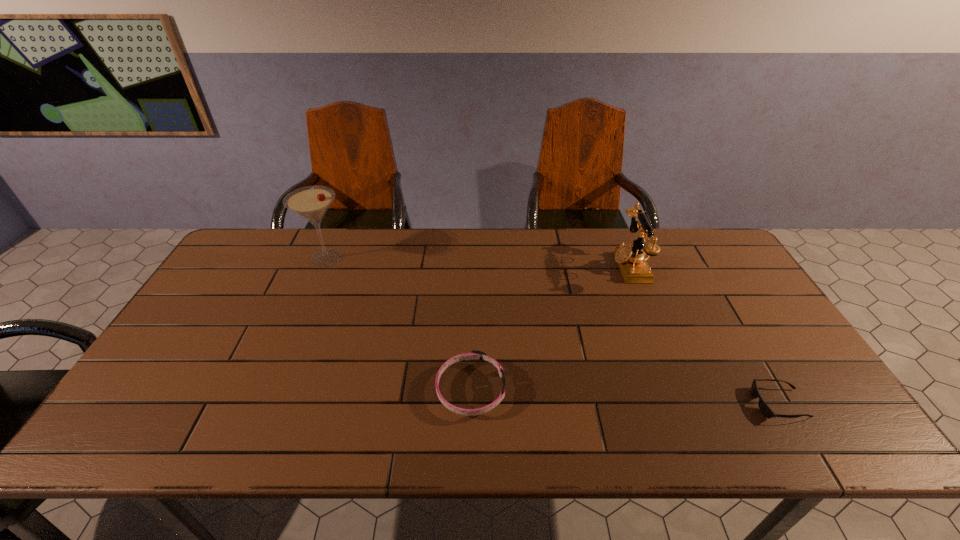
You are a GUI agent. You are given a task and a screenshot of the screen. Output one action in this format:
    pyautogui.click(x=<x>, y=<y>)
    Task: Click on the object located at the right edge
    The height and width of the screenshot is (540, 960).
    Given the screenshot: What is the action you would take?
    pyautogui.click(x=764, y=408)

I want to click on object present at the near right corner, so click(x=764, y=408).

You are a GUI agent. You are given a task and a screenshot of the screen. Output one action in this format:
    pyautogui.click(x=<x>, y=<y>)
    Task: Click on the vacant space at the far edge of the desktop
    This screenshot has height=540, width=960.
    Given the screenshot: What is the action you would take?
    pyautogui.click(x=329, y=245)

The width and height of the screenshot is (960, 540). Find the location of `vacant space at the near edge of the desktop`. vacant space at the near edge of the desktop is located at coordinates (548, 443).

Where is `free space at the left edge of the desktop`? This screenshot has height=540, width=960. free space at the left edge of the desktop is located at coordinates (190, 336).

I want to click on vacant space at the right edge, so click(803, 394).

Locate an element on the screen. free space between the dog collar and the telephone is located at coordinates (550, 328).

In order to click on vacant point located between the rightmost object and the leftmost object in this screenshot , I will do `click(553, 331)`.

Locate an element on the screen. unoccupied area between the rightmost object and the telephone is located at coordinates pyautogui.click(x=705, y=335).

What are the coordinates of `free spot between the second tallest object and the second object from left to right` in the screenshot? It's located at [550, 328].